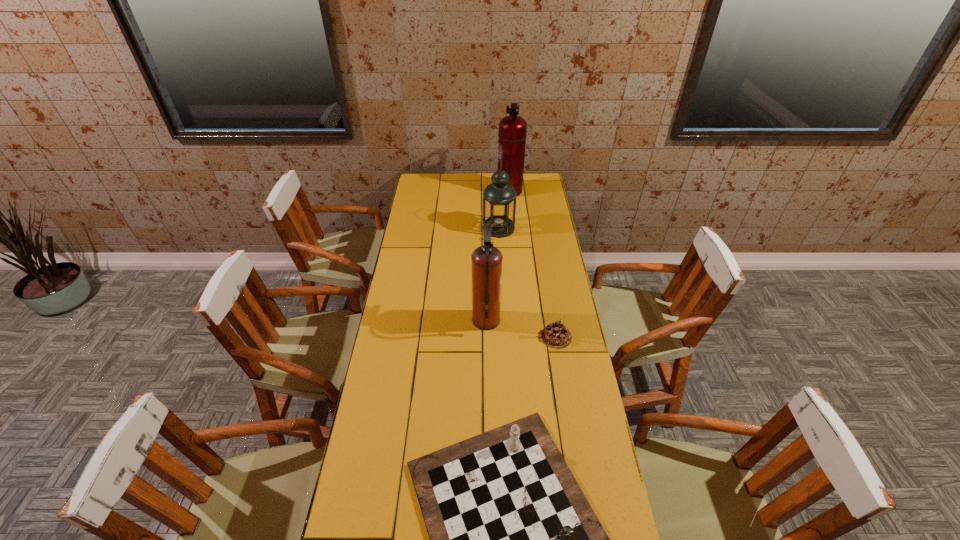
Where is `vacant space located at the nozzle of the nearer fire extinguisher`? The height and width of the screenshot is (540, 960). vacant space located at the nozzle of the nearer fire extinguisher is located at coordinates coord(411,320).

I want to click on free space located at the nozzle of the nearer fire extinguisher, so click(417, 320).

Locate an element on the screen. free space located on the right of the second farthest object is located at coordinates (547, 228).

Find the location of `free space located on the left of the chocolate cake`. free space located on the left of the chocolate cake is located at coordinates (444, 337).

Image resolution: width=960 pixels, height=540 pixels. I want to click on object present at the far edge, so click(x=512, y=135).

I want to click on fire extinguisher situated at the right edge, so click(x=512, y=135).

You are a GUI agent. You are given a task and a screenshot of the screen. Output one action in this format:
    pyautogui.click(x=<x>, y=<y>)
    Task: Click on the chocolate cake that is positioned at the right edge
    
    Given the screenshot: What is the action you would take?
    pyautogui.click(x=555, y=335)

Locate an element on the screen. object at the far right corner is located at coordinates (512, 135).

The width and height of the screenshot is (960, 540). In the image, there is a desktop. Find the location of `free space at the far edge`. free space at the far edge is located at coordinates (468, 173).

The image size is (960, 540). I want to click on free space at the left edge of the desktop, so click(425, 238).